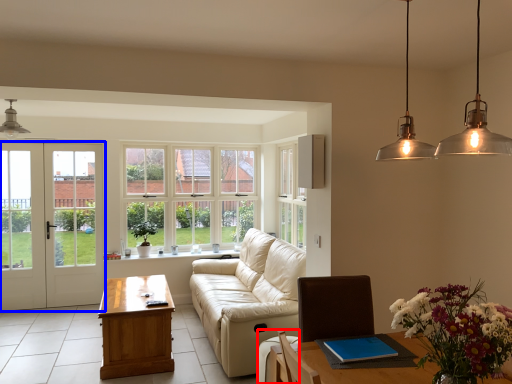
Question: Which of the following is the farthest to the observer, armchair (highlighted by a red box) or door (highlighted by a blue box)?

Choices:
 (A) armchair
 (B) door

Answer: (B)